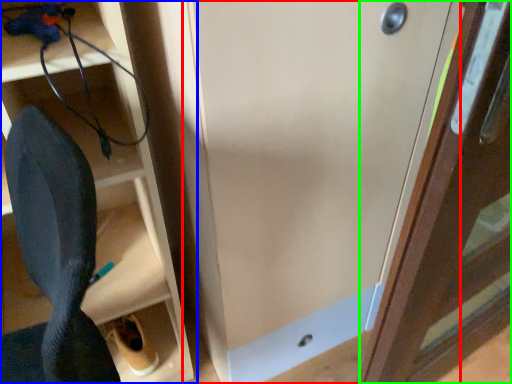
Question: Based on their relative distances, which object is farther from door (highlighted by a red box)? Choose from shelf (highlighted by a blue box) and door (highlighted by a green box).

Choices:
 (A) shelf
 (B) door

Answer: (A)